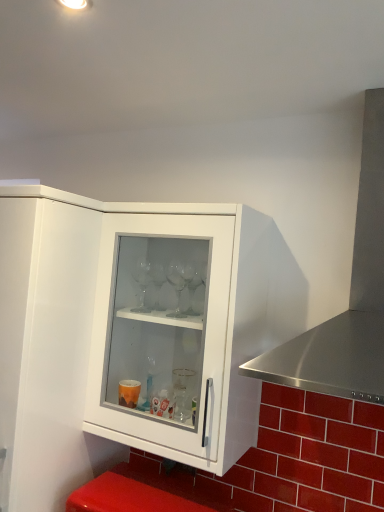
Question: Can you confirm if transparent glass cabinet at center is shorter than white glossy cabinet at upper left?

Choices:
 (A) no
 (B) yes

Answer: (B)

Question: Is transparent glass cabinet at center positioned beyond the bounds of white glossy cabinet at upper left?

Choices:
 (A) yes
 (B) no

Answer: (A)

Question: Is transparent glass cabinet at center taller than white glossy cabinet at upper left?

Choices:
 (A) no
 (B) yes

Answer: (A)

Question: Can white glossy cabinet at upper left be found inside transparent glass cabinet at center?

Choices:
 (A) yes
 (B) no

Answer: (B)

Question: Would you say transparent glass cabinet at center is a long distance from white glossy cabinet at upper left?

Choices:
 (A) no
 (B) yes

Answer: (A)

Question: From the image's perspective, is stainless steel exhaust hood at right above or below white glossy cabinet at upper left?

Choices:
 (A) above
 (B) below

Answer: (A)

Question: Based on their positions, is stainless steel exhaust hood at right located to the left or right of white glossy cabinet at upper left?

Choices:
 (A) left
 (B) right

Answer: (B)

Question: Is stainless steel exhaust hood at right inside the boundaries of white glossy cabinet at upper left, or outside?

Choices:
 (A) inside
 (B) outside

Answer: (B)

Question: Based on their sizes in the image, would you say stainless steel exhaust hood at right is bigger or smaller than white glossy cabinet at upper left?

Choices:
 (A) big
 (B) small

Answer: (B)

Question: Based on their sizes in the image, would you say transparent glass cabinet at center is bigger or smaller than white glossy cabinet at upper left?

Choices:
 (A) big
 (B) small

Answer: (B)

Question: From the image's perspective, is transparent glass cabinet at center located above or below white glossy cabinet at upper left?

Choices:
 (A) below
 (B) above

Answer: (B)

Question: Considering the positions of point (112, 274) and point (13, 423), is point (112, 274) closer or farther from the camera than point (13, 423)?

Choices:
 (A) farther
 (B) closer

Answer: (A)

Question: Which is correct: transparent glass cabinet at center is inside white glossy cabinet at upper left, or outside of it?

Choices:
 (A) inside
 (B) outside

Answer: (B)

Question: Is white glossy cabinet at upper left bigger or smaller than transparent glass cabinet at center?

Choices:
 (A) small
 (B) big

Answer: (B)

Question: From a real-world perspective, is white glossy cabinet at upper left positioned above or below transparent glass cabinet at center?

Choices:
 (A) below
 (B) above

Answer: (A)